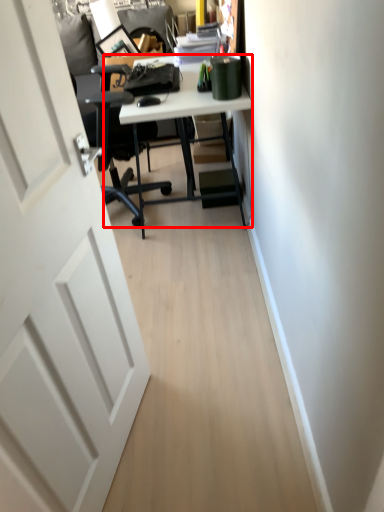
Question: In this image, where is desk (annotated by the red box) located relative to door?

Choices:
 (A) right
 (B) left

Answer: (A)